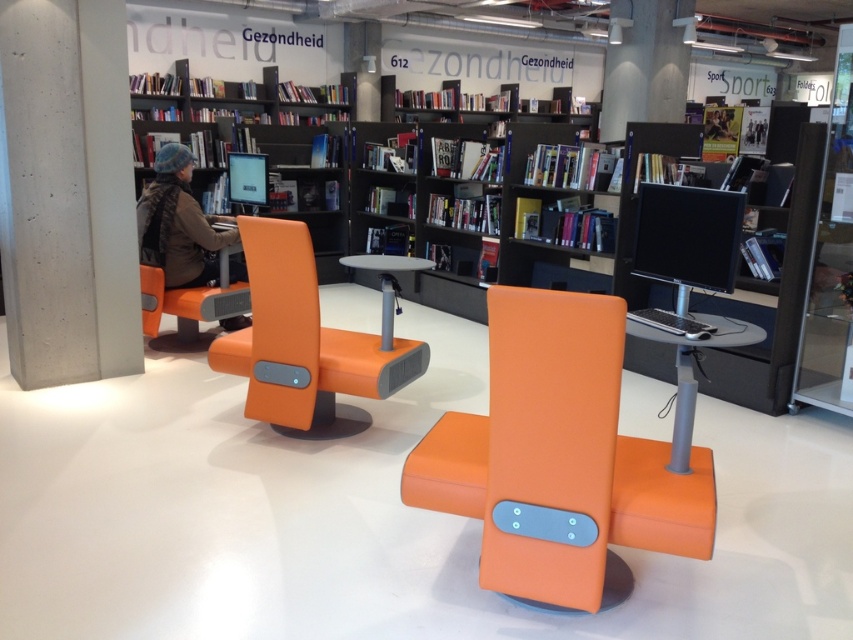
You are standing in the library and want to reach a specific book located at point [288,244]. If your walking distance is limited to 3 meters, will you be able to reach it?

The distance of point [288,244] from viewer is 3.14 meters, so you cannot reach it within your 3 meters limit.

You are sitting in the orange leather armchair at center and want to reach the matte black bookshelf at upper left. Which direction should you move to get closer to the bookshelf?

To reach the matte black bookshelf at upper left from the orange leather armchair at center, you should move to the left since the orange leather armchair at center is positioned to the right of the bookshelf.